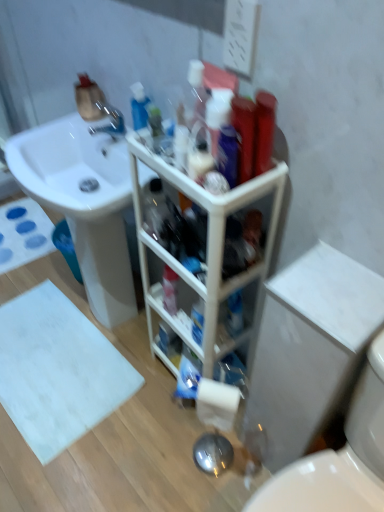
The image size is (384, 512). In order to click on vacant area that is in front of white plastic cabinet at center in this screenshot , I will do `click(168, 450)`.